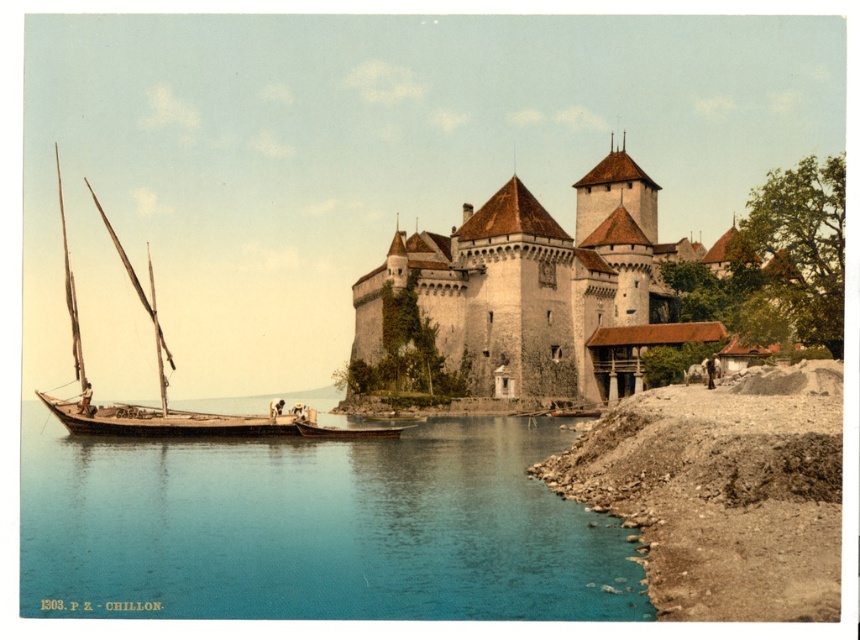
Question: Estimate the real-world distances between objects in this image. Which object is farther from the wooden sailboat at left?

Choices:
 (A) blue water at lower left
 (B) wooden planks boat at lower left
 (C) brown gravel shore at lower right
 (D) white stone castle at center

Answer: (C)

Question: Does blue water at lower left appear over white stone castle at center?

Choices:
 (A) yes
 (B) no

Answer: (B)

Question: Does blue water at lower left have a greater width compared to brown gravel shore at lower right?

Choices:
 (A) no
 (B) yes

Answer: (B)

Question: Which of the following is the closest to the observer?

Choices:
 (A) (587, 218)
 (B) (58, 417)

Answer: (B)

Question: Which point is closer to the camera?

Choices:
 (A) wooden planks boat at lower left
 (B) brown gravel shore at lower right

Answer: (B)

Question: Is brown gravel shore at lower right to the left of white stone castle at center from the viewer's perspective?

Choices:
 (A) yes
 (B) no

Answer: (A)